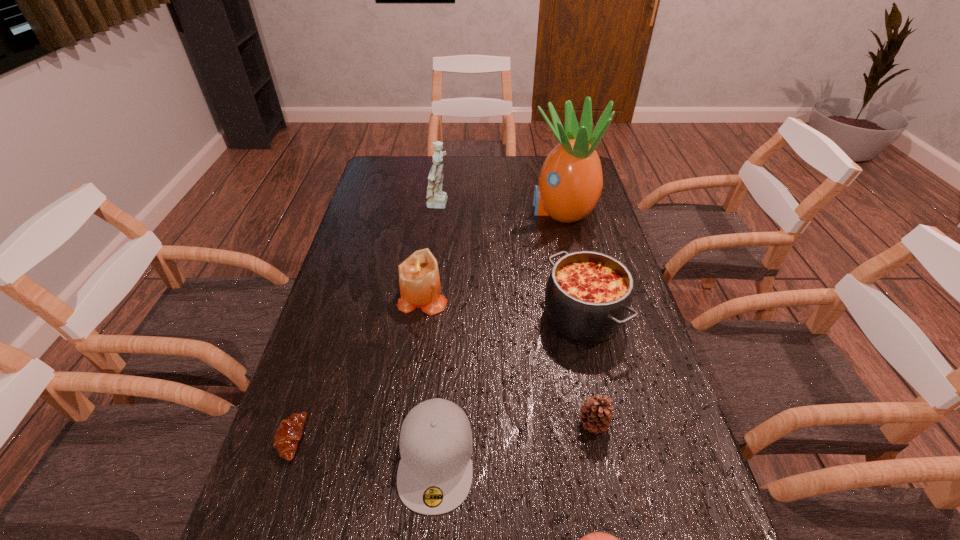
The image size is (960, 540). I want to click on free point located 0.390m at the entrance of the pineapple, so click(420, 210).

The width and height of the screenshot is (960, 540). Find the location of `free location located on the front-facing side of the second tallest object`. free location located on the front-facing side of the second tallest object is located at coordinates (510, 206).

I want to click on free location located on the back of the candle, so tap(434, 210).

Where is `free space located 0.180m on the left of the casserole`? This screenshot has height=540, width=960. free space located 0.180m on the left of the casserole is located at coordinates (477, 316).

I want to click on vacant region located 0.200m on the back of the pinecone, so [576, 341].

The height and width of the screenshot is (540, 960). I want to click on free location located 0.390m on the right of the crescent roll, so click(484, 438).

The width and height of the screenshot is (960, 540). I want to click on object at the left edge, so click(288, 434).

Where is `pineapple positioned at the right edge`? The image size is (960, 540). pineapple positioned at the right edge is located at coordinates (570, 183).

Locate an element on the screen. casserole that is at the right edge is located at coordinates (588, 296).

The height and width of the screenshot is (540, 960). Identify the location of pinecone located in the right edge section of the desktop. (596, 414).